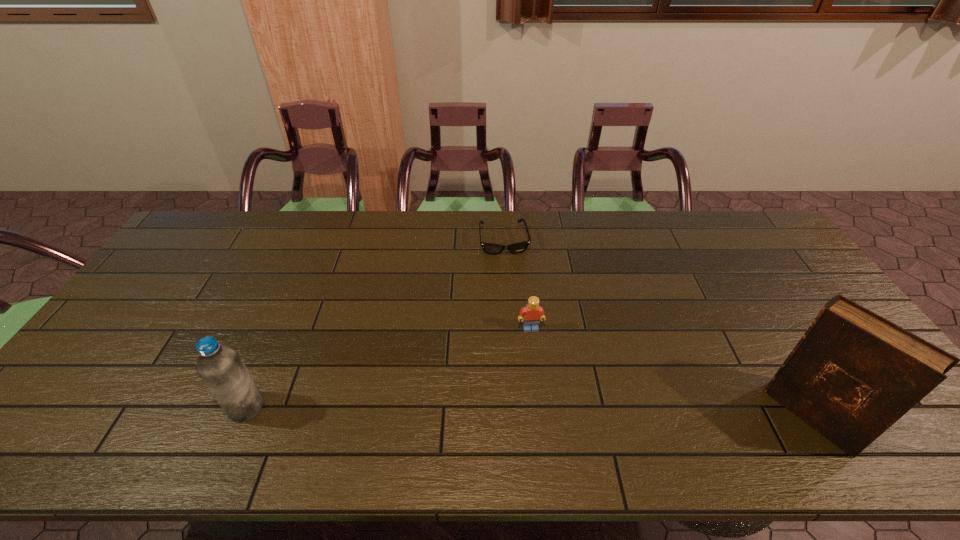
The height and width of the screenshot is (540, 960). Identify the location of free spot between the leftmost object and the Bible. (529, 411).

Where is `free space between the farthest object and the second tallest object`? This screenshot has width=960, height=540. free space between the farthest object and the second tallest object is located at coordinates (375, 324).

Find the location of a particular element. This screenshot has height=540, width=960. unoccupied position between the tallest object and the third shortest object is located at coordinates (529, 411).

The height and width of the screenshot is (540, 960). In order to click on free point between the farthest object and the second shortest object in this screenshot , I will do `click(517, 285)`.

Identify the location of empty space that is in between the farthest object and the second tallest object. The height and width of the screenshot is (540, 960). (375, 324).

Locate an element on the screen. Image resolution: width=960 pixels, height=540 pixels. vacant area that lies between the third nearest object and the sunglasses is located at coordinates (517, 285).

Locate which object is the second closest to the third tallest object. Please provide its 2D coordinates. Your answer should be formatted as a tuple, i.e. [(x, y)], where the tuple contains the x and y coordinates of a point satisfying the conditions above.

[(853, 374)]

Locate an element on the screen. Image resolution: width=960 pixels, height=540 pixels. object identified as the second closest to the Lego is located at coordinates (853, 374).

At what (x,y) coordinates should I click in order to perform the action: click on free point that satisfies the following two spatial constraints: 1. on the front side of the tallest object; 2. on the right side of the shortest object. Please return your answer as a coordinate pair (x, y). Looking at the image, I should click on (516, 415).

Locate an element on the screen. Image resolution: width=960 pixels, height=540 pixels. vacant space that satisfies the following two spatial constraints: 1. on the front side of the second shortest object; 2. on the left side of the shortest object is located at coordinates (510, 328).